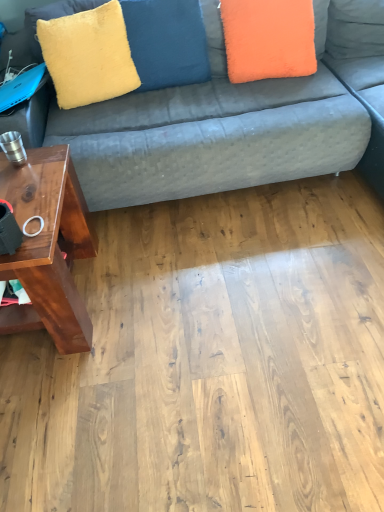
Question: Can you confirm if yellow plush pillow at upper center, acting as the 1th pillow starting from the left, is shorter than yellow fuzzy pillow at upper left?

Choices:
 (A) no
 (B) yes

Answer: (A)

Question: Is yellow plush pillow at upper center, positioned as the 2th pillow in right-to-left order, aimed at yellow fuzzy pillow at upper left?

Choices:
 (A) yes
 (B) no

Answer: (B)

Question: Considering the relative positions of yellow plush pillow at upper center, acting as the 1th pillow starting from the left, and yellow fuzzy pillow at upper left in the image provided, is yellow plush pillow at upper center, acting as the 1th pillow starting from the left, behind yellow fuzzy pillow at upper left?

Choices:
 (A) yes
 (B) no

Answer: (A)

Question: Does yellow plush pillow at upper center, positioned as the 2th pillow in right-to-left order, have a larger size compared to yellow fuzzy pillow at upper left?

Choices:
 (A) yes
 (B) no

Answer: (A)

Question: From a real-world perspective, is yellow plush pillow at upper center, acting as the 1th pillow starting from the left, on yellow fuzzy pillow at upper left?

Choices:
 (A) yes
 (B) no

Answer: (B)

Question: From the image's perspective, is velvet fabric couch at upper center located above or below yellow fuzzy pillow at upper left?

Choices:
 (A) below
 (B) above

Answer: (A)

Question: Visually, is velvet fabric couch at upper center positioned to the left or to the right of yellow fuzzy pillow at upper left?

Choices:
 (A) right
 (B) left

Answer: (A)

Question: Relative to yellow fuzzy pillow at upper left, is velvet fabric couch at upper center in front or behind?

Choices:
 (A) front
 (B) behind

Answer: (A)

Question: Do you think velvet fabric couch at upper center is within yellow fuzzy pillow at upper left, or outside of it?

Choices:
 (A) outside
 (B) inside

Answer: (A)

Question: Is yellow plush pillow at upper center, acting as the 1th pillow starting from the left, in front of or behind orange fuzzy pillow at upper right, acting as the second pillow starting from the left, in the image?

Choices:
 (A) behind
 (B) front

Answer: (A)

Question: From their relative heights in the image, would you say yellow plush pillow at upper center, acting as the 1th pillow starting from the left, is taller or shorter than orange fuzzy pillow at upper right, acting as the second pillow starting from the left?

Choices:
 (A) short
 (B) tall

Answer: (B)

Question: Which is correct: yellow plush pillow at upper center, positioned as the 2th pillow in right-to-left order, is inside orange fuzzy pillow at upper right, acting as the second pillow starting from the left, or outside of it?

Choices:
 (A) inside
 (B) outside

Answer: (B)

Question: From the image's perspective, is yellow plush pillow at upper center, positioned as the 2th pillow in right-to-left order, above or below orange fuzzy pillow at upper right, the 1th pillow in the right-to-left sequence?

Choices:
 (A) above
 (B) below

Answer: (A)

Question: From the image's perspective, is brown wood table at left located above or below velvet fabric couch at upper center?

Choices:
 (A) below
 (B) above

Answer: (A)

Question: Is brown wood table at left inside the boundaries of velvet fabric couch at upper center, or outside?

Choices:
 (A) inside
 (B) outside

Answer: (A)